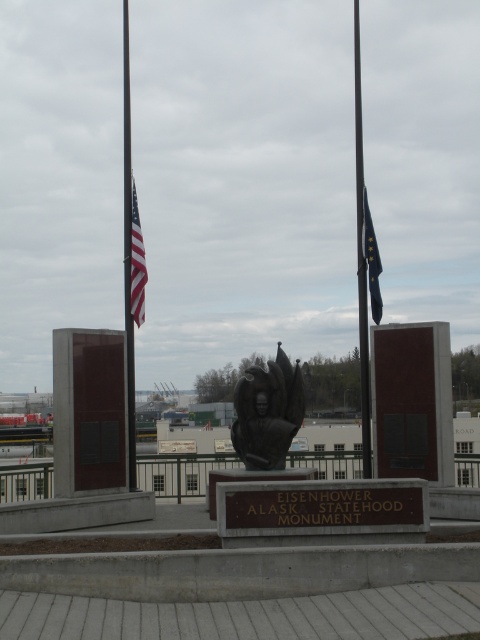
You are a visitor at the memorial site and want to take a photo of the matte black flag at center. However, you notice that the polished metal flagpole at left is blocking your view. Based on their positions, can you determine if the flagpole is in front of or behind the flag?

The polished metal flagpole at left is above the matte black flag at center, so it is positioned in front of the flag, blocking the view.

You are standing at the camera position and want to place a new flag on the polished metal flagpole at left. The flag requires a minimum of 50 feet distance from the camera for proper installation. Can you confirm if the distance is sufficient?

The polished metal flagpole at left is 52.01 feet away from camera, which exceeds the required 50 feet distance. Therefore, the flag can be installed properly.